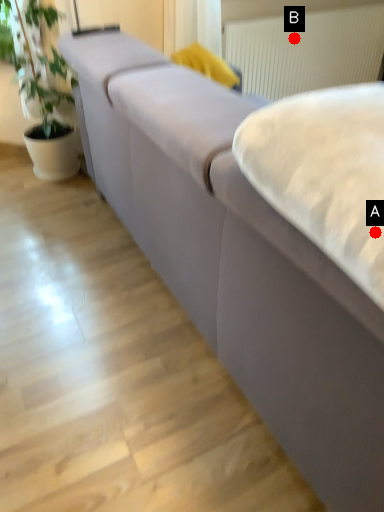
Question: Two points are circled on the image, labeled by A and B beside each circle. Among these points, which one is nearest to the camera?

Choices:
 (A) A is closer
 (B) B is closer

Answer: (A)